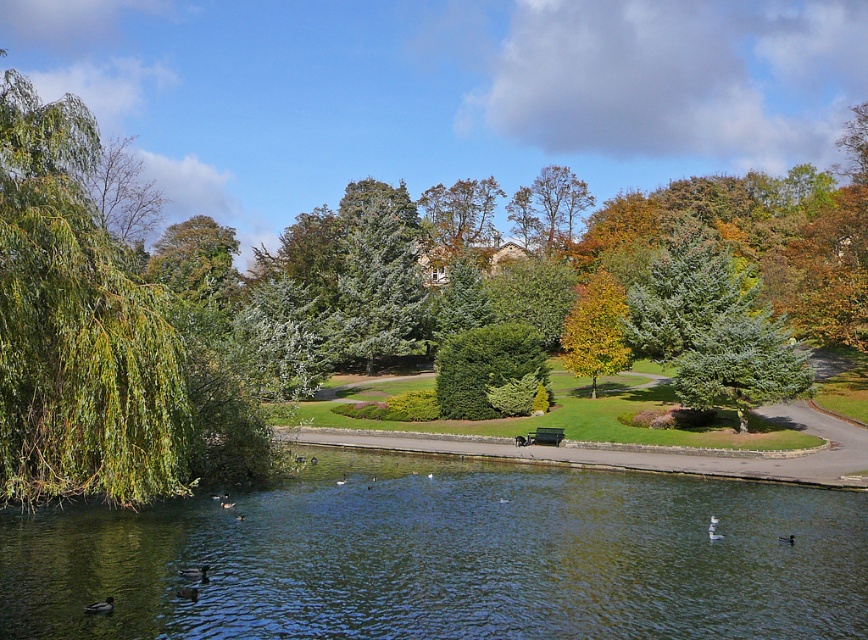
Can you confirm if dark brown feathers at lower left is thinner than dark gray matte duck at lower right?

No.

Who is lower down, dark brown feathers at lower left or dark gray matte duck at lower right?

dark gray matte duck at lower right

The width and height of the screenshot is (868, 640). Describe the element at coordinates (99, 605) in the screenshot. I see `dark brown feathers at lower left` at that location.

You are a GUI agent. You are given a task and a screenshot of the screen. Output one action in this format:
    pyautogui.click(x=<x>, y=<y>)
    Task: Click on the dark brown feathers at lower left
    The image size is (868, 640).
    Given the screenshot: What is the action you would take?
    pyautogui.click(x=99, y=605)

Can you confirm if green reflective water at center is thinner than dark gray matte duck at lower right?

No.

Consider the image. Between green reflective water at center and dark gray matte duck at lower right, which one appears on the left side from the viewer's perspective?

From the viewer's perspective, green reflective water at center appears more on the left side.

Is point (307, 532) in front of point (792, 536)?

Yes.

Where is `green reflective water at center`? The width and height of the screenshot is (868, 640). green reflective water at center is located at coordinates (446, 557).

Who is taller, dark gray matte duck at lower right or brown fuzzy duck at lower left?

Standing taller between the two is dark gray matte duck at lower right.

Does dark gray matte duck at lower right lie in front of brown fuzzy duck at lower left?

Yes.

In order to click on dark gray matte duck at lower right in this screenshot , I will do `click(786, 538)`.